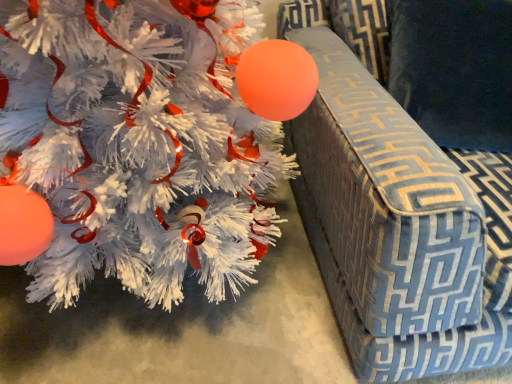
Question: Would you consider velvety blue pillow at upper right to be distant from white matte christmas tree at left?

Choices:
 (A) yes
 (B) no

Answer: (B)

Question: Is velvety blue pillow at upper right facing towards white matte christmas tree at left?

Choices:
 (A) yes
 (B) no

Answer: (B)

Question: Is the position of velvety blue pillow at upper right more distant than that of white matte christmas tree at left?

Choices:
 (A) no
 (B) yes

Answer: (B)

Question: Is velvety blue pillow at upper right beside white matte christmas tree at left?

Choices:
 (A) yes
 (B) no

Answer: (B)

Question: Does velvety blue pillow at upper right have a larger size compared to white matte christmas tree at left?

Choices:
 (A) no
 (B) yes

Answer: (A)

Question: Does point (258, 160) appear closer or farther from the camera than point (437, 69)?

Choices:
 (A) farther
 (B) closer

Answer: (A)

Question: From the image's perspective, relative to velvety blue pillow at upper right, is white matte christmas tree at left above or below?

Choices:
 (A) below
 (B) above

Answer: (A)

Question: From their relative heights in the image, would you say white matte christmas tree at left is taller or shorter than velvety blue pillow at upper right?

Choices:
 (A) short
 (B) tall

Answer: (B)

Question: Looking at their shapes, would you say white matte christmas tree at left is wider or thinner than velvety blue pillow at upper right?

Choices:
 (A) thin
 (B) wide

Answer: (B)

Question: Is blue patterned fabric armchair at right taller or shorter than white matte christmas tree at left?

Choices:
 (A) tall
 (B) short

Answer: (A)

Question: Is blue patterned fabric armchair at right inside the boundaries of white matte christmas tree at left, or outside?

Choices:
 (A) outside
 (B) inside

Answer: (A)

Question: Is blue patterned fabric armchair at right in front of or behind white matte christmas tree at left in the image?

Choices:
 (A) behind
 (B) front

Answer: (B)

Question: Does point (372, 292) appear closer or farther from the camera than point (146, 125)?

Choices:
 (A) closer
 (B) farther

Answer: (A)

Question: In the image, is blue patterned fabric armchair at right on the left side or the right side of velvety blue pillow at upper right?

Choices:
 (A) left
 (B) right

Answer: (B)

Question: Relative to velvety blue pillow at upper right, is blue patterned fabric armchair at right in front or behind?

Choices:
 (A) behind
 (B) front

Answer: (B)